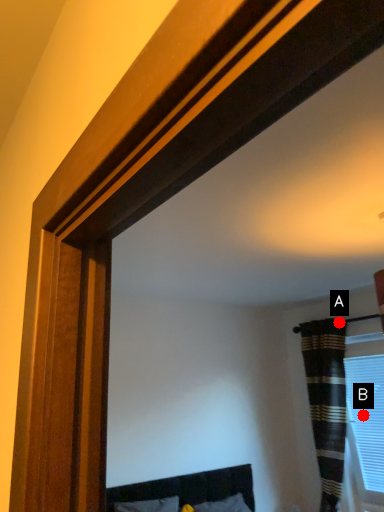
Question: Two points are circled on the image, labeled by A and B beside each circle. Which point is farther to the camera?

Choices:
 (A) A is further
 (B) B is further

Answer: (A)